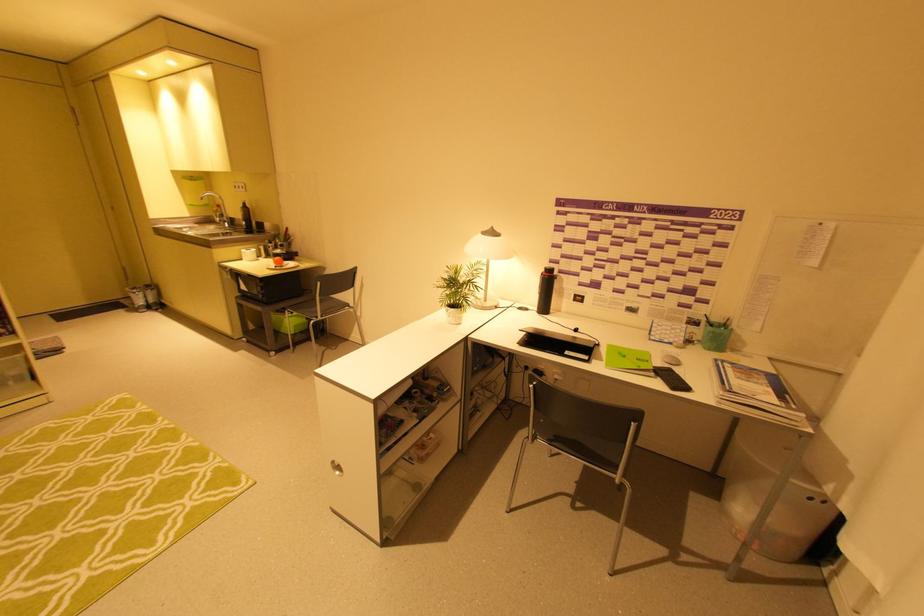
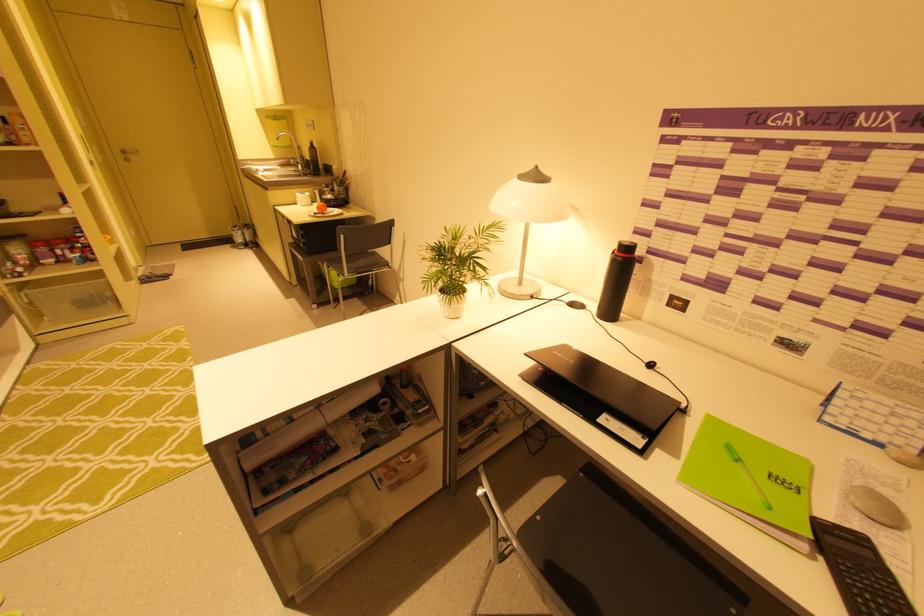
The point at (210, 222) is marked in the first image. Where is the corresponding point in the second image?

(293, 164)